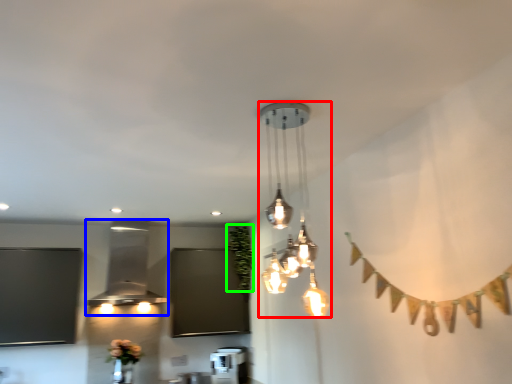
Question: Considering the real-world distances, which object is closest to lamp (highlighted by a red box)? lamp (highlighted by a blue box) or plant (highlighted by a green box).

Choices:
 (A) lamp
 (B) plant

Answer: (B)